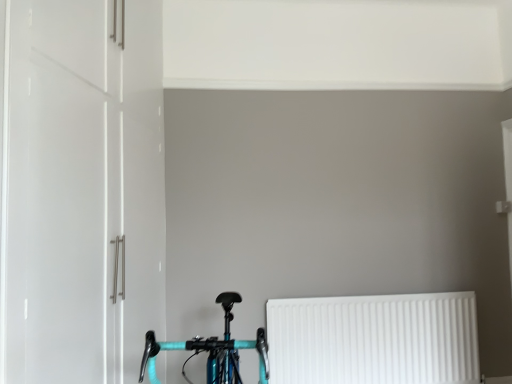
Question: From the image's perspective, does teal glossy bicycle at lower center appear higher than white plastic radiator at lower right?

Choices:
 (A) no
 (B) yes

Answer: (B)

Question: Is teal glossy bicycle at lower center thinner than white plastic radiator at lower right?

Choices:
 (A) no
 (B) yes

Answer: (A)

Question: Is teal glossy bicycle at lower center to the left of white plastic radiator at lower right from the viewer's perspective?

Choices:
 (A) yes
 (B) no

Answer: (A)

Question: Is teal glossy bicycle at lower center surrounding white plastic radiator at lower right?

Choices:
 (A) no
 (B) yes

Answer: (A)

Question: Can you confirm if teal glossy bicycle at lower center is smaller than white plastic radiator at lower right?

Choices:
 (A) no
 (B) yes

Answer: (A)

Question: Is teal glossy bicycle at lower center turned away from white plastic radiator at lower right?

Choices:
 (A) yes
 (B) no

Answer: (B)

Question: Is white plastic radiator at lower right not close to white glossy cabinet at left?

Choices:
 (A) no
 (B) yes

Answer: (B)

Question: From a real-world perspective, is white plastic radiator at lower right under white glossy cabinet at left?

Choices:
 (A) no
 (B) yes

Answer: (B)

Question: Is white plastic radiator at lower right thinner than white glossy cabinet at left?

Choices:
 (A) no
 (B) yes

Answer: (B)

Question: Is white plastic radiator at lower right completely or partially outside of white glossy cabinet at left?

Choices:
 (A) yes
 (B) no

Answer: (A)

Question: Would you say white plastic radiator at lower right contains white glossy cabinet at left?

Choices:
 (A) no
 (B) yes

Answer: (A)

Question: Is white plastic radiator at lower right further to camera compared to white glossy cabinet at left?

Choices:
 (A) no
 (B) yes

Answer: (B)

Question: From a real-world perspective, is white glossy cabinet at left beneath teal glossy bicycle at lower center?

Choices:
 (A) yes
 (B) no

Answer: (B)